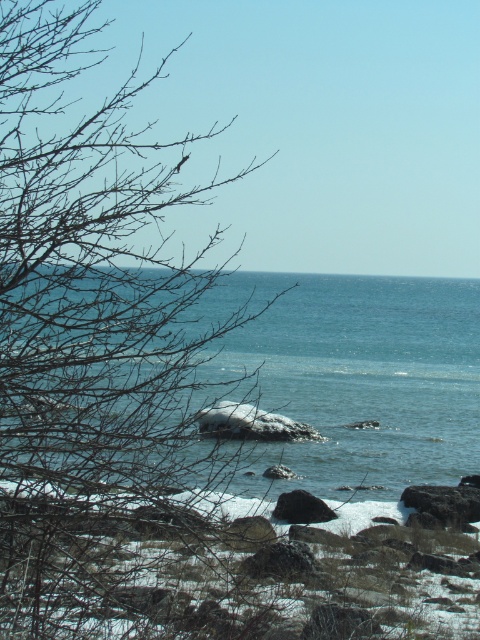
Between bare branches at left and smooth gray rock at center, which one is positioned lower?

smooth gray rock at center is below.

Between bare branches at left and smooth gray rock at center, which one is positioned higher?

bare branches at left is above.

You are a GUI agent. You are given a task and a screenshot of the screen. Output one action in this format:
    pyautogui.click(x=<x>, y=<y>)
    Task: Click on the bare branches at left
    
    Given the screenshot: What is the action you would take?
    click(x=88, y=337)

Is point (129, 234) positioned in front of point (458, 484)?

Yes, it is.

Find the location of a particular element. bare branches at left is located at coordinates (x=88, y=337).

Who is more forward, (x=26, y=141) or (x=420, y=500)?

Positioned in front is point (x=26, y=141).

I want to click on bare branches at left, so click(88, 337).

Does smooth gray rock at lower right lie in front of smooth gray rock at center?

That is True.

Who is positioned more to the right, smooth gray rock at lower right or smooth gray rock at center?

smooth gray rock at lower right is more to the right.

This screenshot has width=480, height=640. What are the coordinates of `smooth gray rock at lower right` in the screenshot? It's located at [444, 504].

Locate an element on the screen. This screenshot has width=480, height=640. smooth gray rock at lower right is located at coordinates (444, 504).